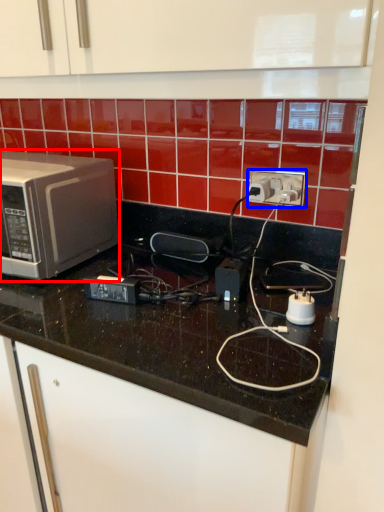
Question: Which object appears closest to the camera in this image, microwave oven (highlighted by a red box) or power plugs and sockets (highlighted by a blue box)?

Choices:
 (A) microwave oven
 (B) power plugs and sockets

Answer: (A)